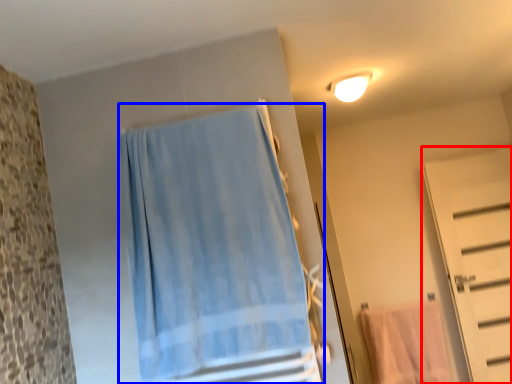
Question: Which object is closer to the camera taking this photo, door (highlighted by a red box) or curtain (highlighted by a blue box)?

Choices:
 (A) door
 (B) curtain

Answer: (B)